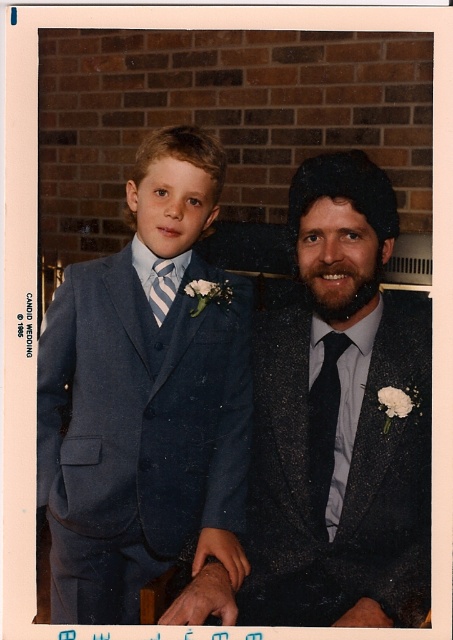
Is black satin tie at center shorter than striped fabric tie at left?

Incorrect, black satin tie at center's height does not fall short of striped fabric tie at left's.

Is point (313, 456) more distant than point (150, 292)?

No.

You are a GUI agent. You are given a task and a screenshot of the screen. Output one action in this format:
    pyautogui.click(x=<x>, y=<y>)
    Task: Click on the black satin tie at center
    This screenshot has width=453, height=640.
    Given the screenshot: What is the action you would take?
    pyautogui.click(x=323, y=426)

Is matte black suit at center taller than black satin tie at center?

Correct, matte black suit at center is much taller as black satin tie at center.

Consider the image. Who is more distant from viewer, (x=302, y=593) or (x=324, y=506)?

The point (x=302, y=593) is more distant.

Image resolution: width=453 pixels, height=640 pixels. Find the location of `matte black suit at center`. matte black suit at center is located at coordinates (333, 428).

Between matte blue suit at left and striped fabric tie at left, which one appears on the right side from the viewer's perspective?

striped fabric tie at left

Can you confirm if matte blue suit at left is positioned to the right of striped fabric tie at left?

No, matte blue suit at left is not to the right of striped fabric tie at left.

Does point (245, 572) come closer to viewer compared to point (163, 268)?

Yes, point (245, 572) is closer to viewer.

Find the location of a particular element. matte blue suit at left is located at coordinates (144, 397).